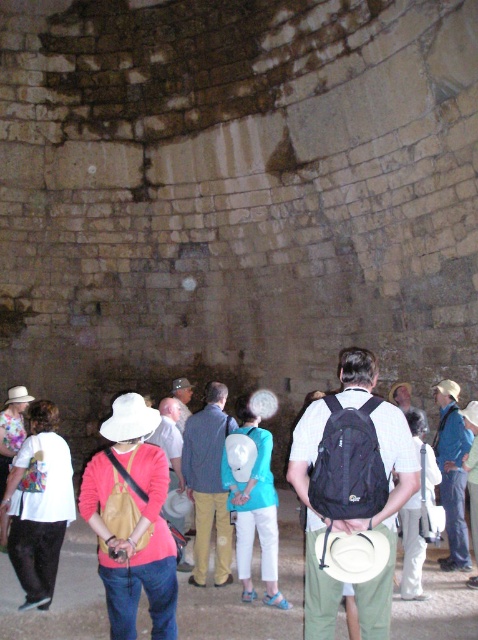
Question: Which of the following is the farthest from the observer?

Choices:
 (A) floral print shirt at left
 (B) matte black backpack at center
 (C) matte yellow bag at center
 (D) white matte backpack at center

Answer: (A)

Question: Can you confirm if matte yellow backpack at center is positioned to the left of matte black backpack at center?

Choices:
 (A) yes
 (B) no

Answer: (A)

Question: Observing the image, what is the correct spatial positioning of matte yellow backpack at center in reference to white cotton hat at lower left?

Choices:
 (A) right
 (B) left

Answer: (A)

Question: Which object appears closest to the camera in this image?

Choices:
 (A) matte yellow bag at center
 (B) matte black backpack at center
 (C) black fabric backpack at center
 (D) floral print shirt at left

Answer: (C)

Question: Where is white matte backpack at center located in relation to blue fabric backpack at center in the image?

Choices:
 (A) below
 (B) above

Answer: (A)

Question: Considering the real-world distances, which object is farthest from the matte black backpack at center?

Choices:
 (A) blue denim shirt at center
 (B) blue denim jeans at lower right
 (C) matte yellow bag at center

Answer: (C)